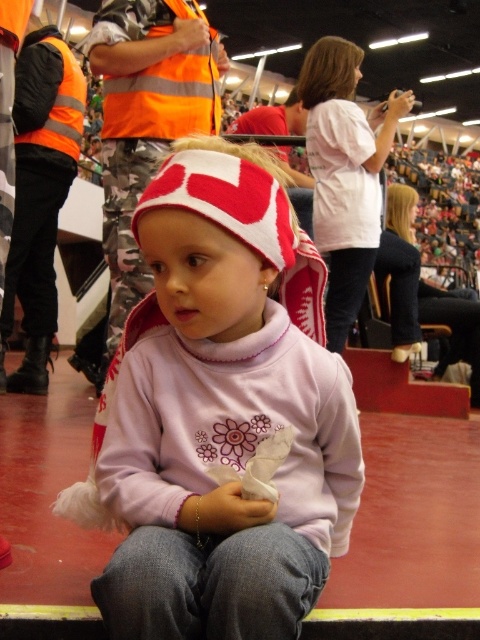
You are a photographer trying to capture a clear shot of the matte pink sweater at center and the matte white shirt at center. Since you want both items to be in focus, which one should you adjust your camera focus on first?

The matte pink sweater at center is closer to the viewer than the matte white shirt at center. To ensure both are in focus, you should focus on the matte pink sweater at center first, as it is closer, and use a smaller aperture to increase the depth of field so the matte white shirt at center also stays sharp.

You are a delivery person who needs to place a small package between the matte pink sweater at center and the matte white shirt at center. The package requires a minimum of 2 meters of space between the two items. Can you place it there?

The matte pink sweater at center is 2.42 meters from the matte white shirt at center, so yes, the package can be placed between them as the distance meets the required minimum of 2 meters.